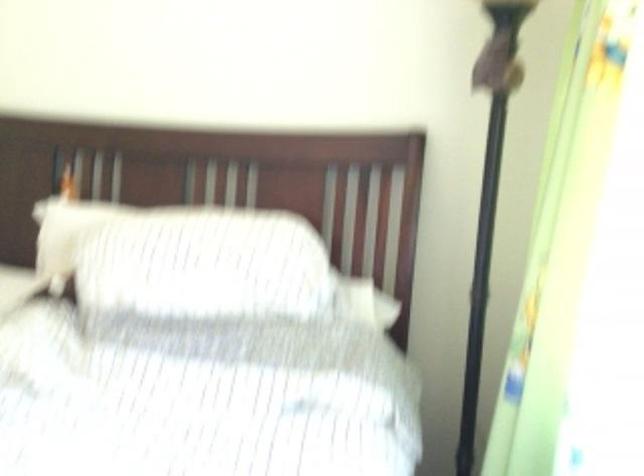
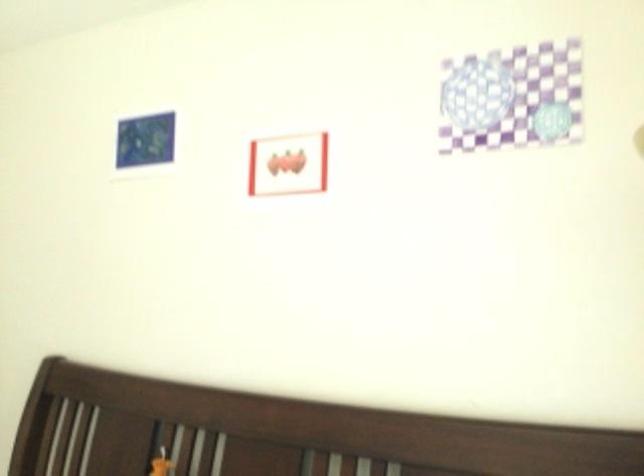
Question: The images are taken continuously from a first-person perspective. In which direction are you moving?

Choices:
 (A) Left
 (B) Right
 (C) Forward
 (D) Backward

Answer: (C)